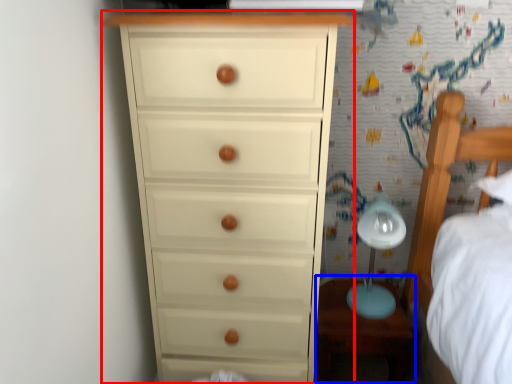
Question: Which object appears farthest to the camera in this image, chest of drawers (highlighted by a red box) or table (highlighted by a blue box)?

Choices:
 (A) chest of drawers
 (B) table

Answer: (B)